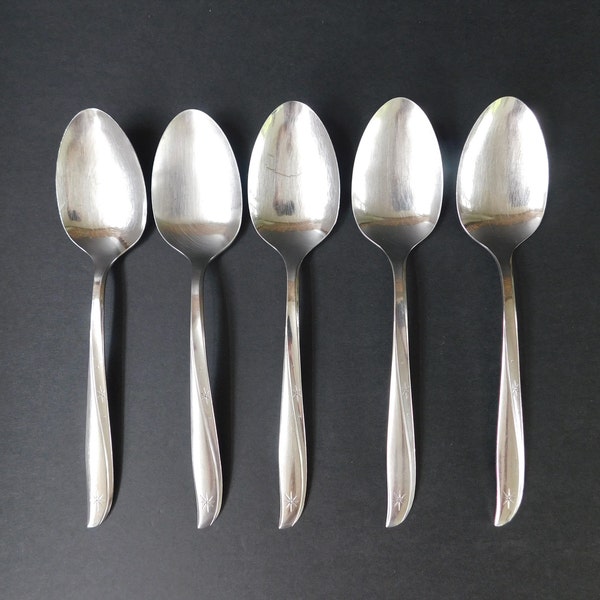
At what (x,y) coordinates should I click in order to perform the action: click on spoons. Please return your answer as a coordinate pair (x, y). The image size is (600, 600). Looking at the image, I should click on (116, 201), (201, 201), (292, 203), (400, 199), (483, 206).